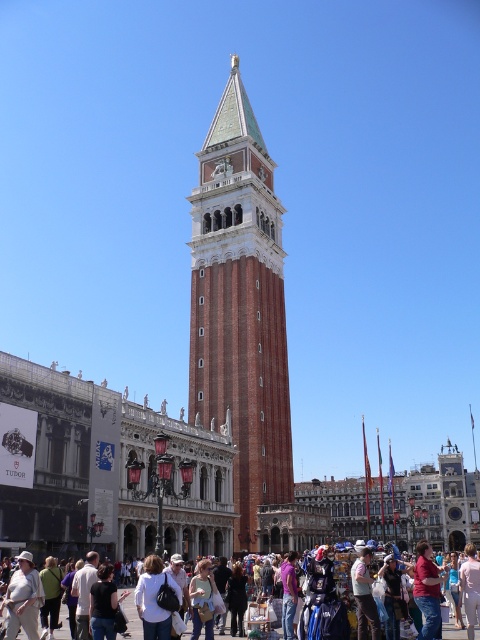
Consider the image. Measure the distance between red brick bell tower at center and camera.

A distance of 54.76 meters exists between red brick bell tower at center and camera.

Does red brick bell tower at center have a greater width compared to matte white crowd at lower center?

In fact, red brick bell tower at center might be narrower than matte white crowd at lower center.

Describe the element at coordinates (240, 307) in the screenshot. I see `red brick bell tower at center` at that location.

Locate an element on the screen. This screenshot has width=480, height=640. red brick bell tower at center is located at coordinates (240, 307).

Which of these two, red brick bell tower at center or matte pink shirt at center, stands shorter?

matte pink shirt at center is shorter.

Can you confirm if red brick bell tower at center is positioned below matte pink shirt at center?

Incorrect, red brick bell tower at center is not positioned below matte pink shirt at center.

Does point (243, 442) lie in front of point (419, 547)?

That is False.

The height and width of the screenshot is (640, 480). Identify the location of red brick bell tower at center. (240, 307).

Does matte pink shirt at center have a greater height compared to matte white crowd at lower center?

Correct, matte pink shirt at center is much taller as matte white crowd at lower center.

Between matte pink shirt at center and matte white crowd at lower center, which one has less height?

matte white crowd at lower center is shorter.

Does point (434, 621) come farther from viewer compared to point (443, 628)?

That is False.

Identify the location of matte pink shirt at center. Image resolution: width=480 pixels, height=640 pixels. pos(428,589).